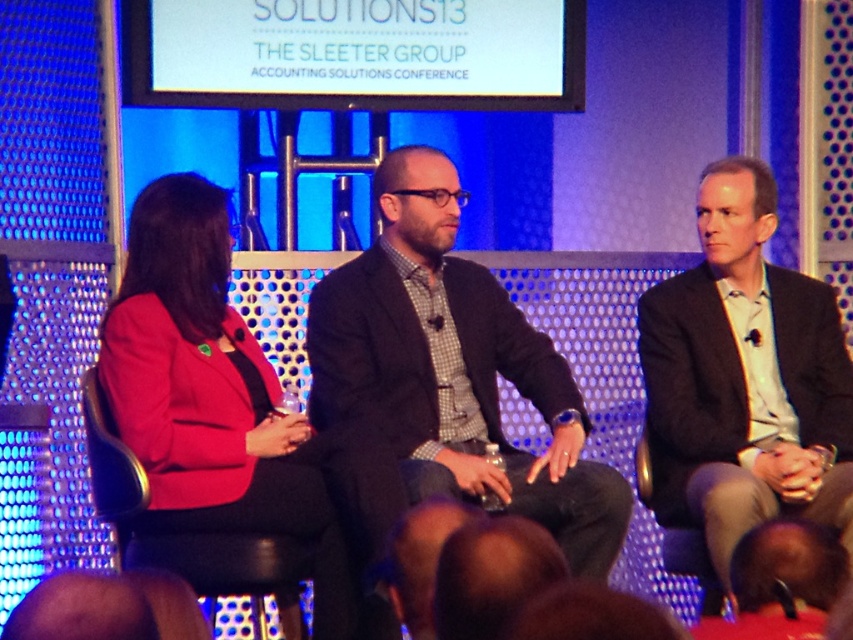
Is matte black blazer at center shorter than dark gray fabric chair at right?

Incorrect, matte black blazer at center's height does not fall short of dark gray fabric chair at right's.

Which is below, matte black blazer at center or dark gray fabric chair at right?

Positioned lower is dark gray fabric chair at right.

At what (x,y) coordinates should I click in order to perform the action: click on matte black blazer at center. Please return your answer as a coordinate pair (x, y). Looking at the image, I should click on (454, 371).

At what (x,y) coordinates should I click in order to perform the action: click on matte black blazer at center. Please return your answer as a coordinate pair (x, y). The height and width of the screenshot is (640, 853). Looking at the image, I should click on pos(454,371).

Is point (723, 339) positioned behind point (262, 568)?

Yes.

Between light brown suit at right and black leather chair at left, which one appears on the left side from the viewer's perspective?

From the viewer's perspective, black leather chair at left appears more on the left side.

Find the location of a particular element. The height and width of the screenshot is (640, 853). light brown suit at right is located at coordinates (744, 378).

Does matte black blazer at center lie behind light brown suit at right?

Yes, it is.

The height and width of the screenshot is (640, 853). Identify the location of matte black blazer at center. (454, 371).

The height and width of the screenshot is (640, 853). Find the location of `matte black blazer at center`. matte black blazer at center is located at coordinates (454, 371).

The height and width of the screenshot is (640, 853). Identify the location of matte black blazer at center. (454, 371).